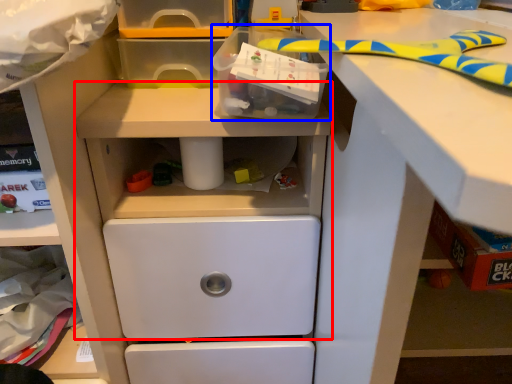
Question: Which object appears farthest to the camera in this image, workbench (highlighted by a red box) or box (highlighted by a blue box)?

Choices:
 (A) workbench
 (B) box

Answer: (A)